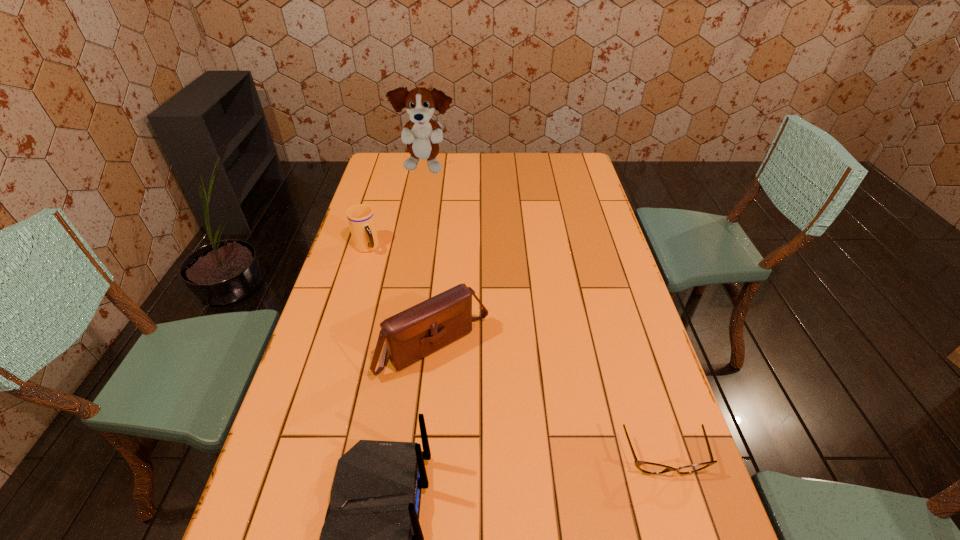
Locate an element on the screen. the shortest object is located at coordinates (647, 467).

Identify the location of the rightmost object. [647, 467].

Find the location of a particular element. Image resolution: width=960 pixels, height=540 pixels. the third farthest object is located at coordinates (413, 334).

Identify the location of shoulder bag. (413, 334).

You are a GUI agent. You are given a task and a screenshot of the screen. Output one action in this format:
    pyautogui.click(x=<x>, y=<y>)
    Task: Click on the fourth nearest object
    This screenshot has height=540, width=960.
    Given the screenshot: What is the action you would take?
    pyautogui.click(x=361, y=220)

Where is `the fourth tallest object`? The image size is (960, 540). the fourth tallest object is located at coordinates (361, 220).

Find the location of `the tallest object`. the tallest object is located at coordinates pos(421,134).

The width and height of the screenshot is (960, 540). Find the location of `puppy`. puppy is located at coordinates (421, 134).

Locate an element on the screen. The image size is (960, 540). free space located on the front-facing side of the rightmost object is located at coordinates (680, 509).

This screenshot has width=960, height=540. What are the coordinates of `vacant point located 0.150m on the front flap of the shoulder bag` in the screenshot? It's located at (502, 419).